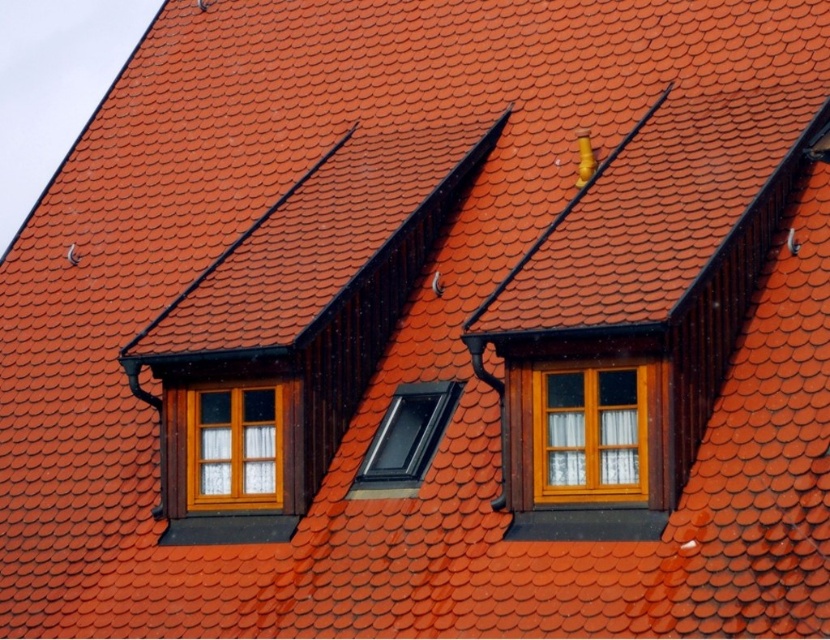
Question: Which of the following is the farthest from the observer?

Choices:
 (A) (640, 374)
 (B) (223, 438)
 (C) (398, 488)

Answer: (B)

Question: Does matte wood window at center have a lesser width compared to transparent plastic skylight at center?

Choices:
 (A) no
 (B) yes

Answer: (B)

Question: Is matte wood window at center smaller than transparent plastic skylight at center?

Choices:
 (A) yes
 (B) no

Answer: (A)

Question: Based on their relative distances, which object is nearer to the matte wood window at center?

Choices:
 (A) wooden window at center
 (B) transparent plastic skylight at center

Answer: (B)

Question: Is matte wood window at center below wooden window at center?

Choices:
 (A) no
 (B) yes

Answer: (A)

Question: Which of the following is the farthest from the observer?

Choices:
 (A) (208, 436)
 (B) (628, 419)

Answer: (A)